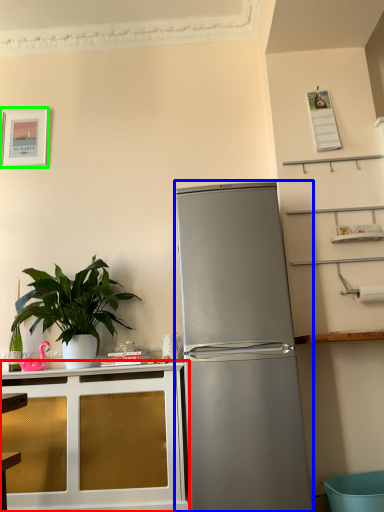
Question: Which is nearer to the cabinetry (highlighted by a red box)? refrigerator (highlighted by a blue box) or picture frame (highlighted by a green box).

Choices:
 (A) refrigerator
 (B) picture frame

Answer: (A)